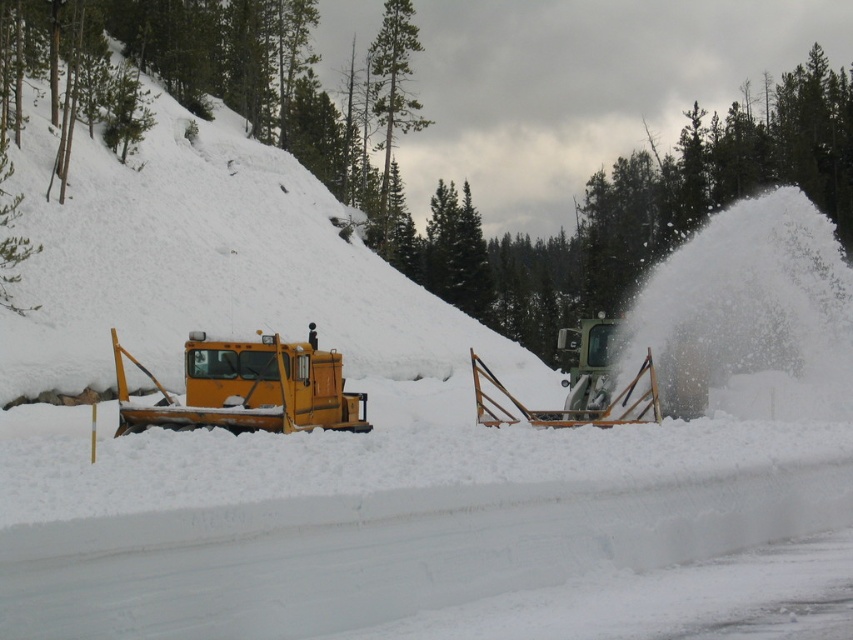
You are a snowplow operator who needs to clear the road. You see the white snow at upper left and the metallic silver plow at center. Which object is higher in elevation?

The white snow at upper left is taller than the metallic silver plow at center, so the white snow at upper left is higher in elevation.